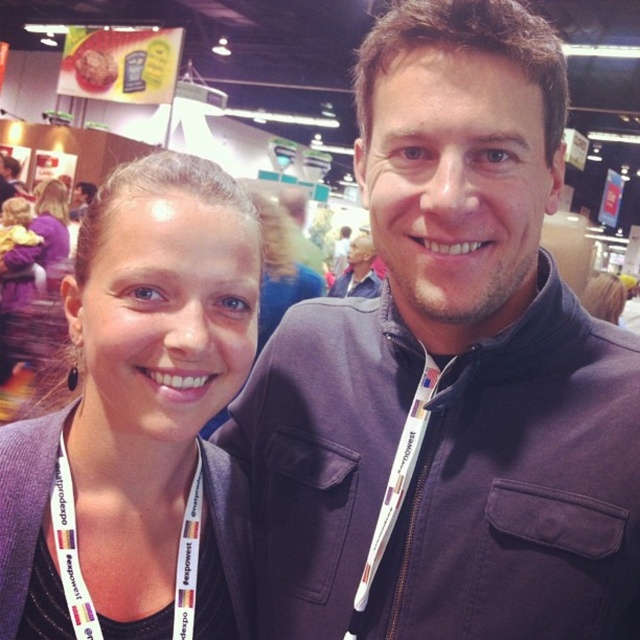
You are a photographer at an expo. You need to ensure that the dark blue jacket at center and the matte black neck at center are visible in your photo. Which object should you focus on to ensure both are in frame?

The dark blue jacket at center has a greater height compared to the matte black neck at center, so focusing on the dark blue jacket at center will ensure both are in frame.

You are a photographer at an expo. You need to place a 10cm wide name tag on the neck of the person with the wider matte neck. Which neck should you choose between the matte black neck at center and the matte gray neck at center?

The matte black neck at center has a greater width than the matte gray neck at center, so you should place the name tag on the matte black neck at center.

You are a photographer at an expo. You want to place a small sticker exactly at the point with coordinates (132,440) on the image. According to the scene description, where should you place the sticker?

The point with coordinates (132,440) is on the matte black neck at center, so place the sticker on the matte black neck at center.